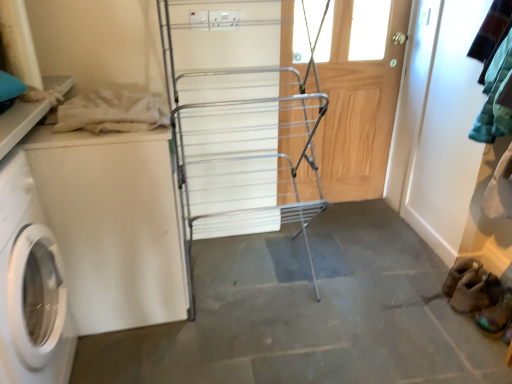
Image resolution: width=512 pixels, height=384 pixels. I want to click on free location to the left of brown suede shoe at lower right, which ranks as the second shoe in back-to-front order, so click(x=453, y=333).